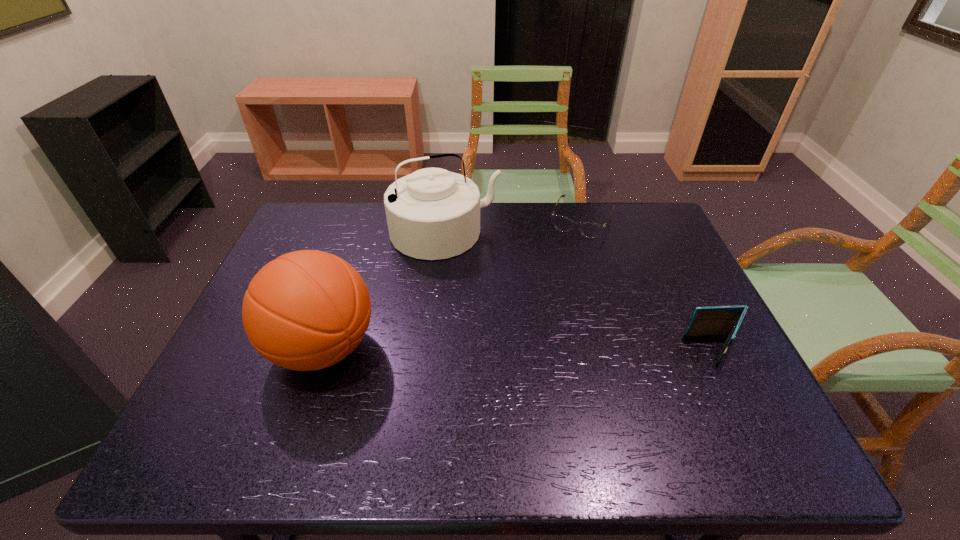
Find the location of a particular element. free space at the far right corner is located at coordinates (637, 236).

At what (x,y) coordinates should I click in order to perform the action: click on vacant region at the near right corner. Please return your answer as a coordinate pair (x, y). The width and height of the screenshot is (960, 540). Looking at the image, I should click on (701, 394).

Find the location of `vacant space that is in between the kettle and the wallet`. vacant space that is in between the kettle and the wallet is located at coordinates (580, 291).

Locate an element on the screen. free point between the basketball and the spectacles is located at coordinates (452, 284).

Find the location of `empty space that is in between the second object from right to left and the second shortest object`. empty space that is in between the second object from right to left and the second shortest object is located at coordinates [649, 285].

This screenshot has height=540, width=960. I want to click on unoccupied area between the kettle and the basketball, so click(384, 290).

You are a GUI agent. You are given a task and a screenshot of the screen. Output one action in this format:
    pyautogui.click(x=<x>, y=<y>)
    Task: Click on the free space between the second shortest object and the kettle
    This screenshot has width=960, height=540.
    Given the screenshot: What is the action you would take?
    pyautogui.click(x=580, y=291)

Identify the location of empty space between the kettle and the basketball. This screenshot has height=540, width=960. (384, 290).

You are a GUI agent. You are given a task and a screenshot of the screen. Output one action in this format:
    pyautogui.click(x=<x>, y=<y>)
    Task: Click on the free space between the kettle and the second object from right to left
    This screenshot has height=540, width=960.
    Given the screenshot: What is the action you would take?
    pyautogui.click(x=514, y=226)

Find the location of a particular element. vacant area between the basketball and the wallet is located at coordinates (519, 349).